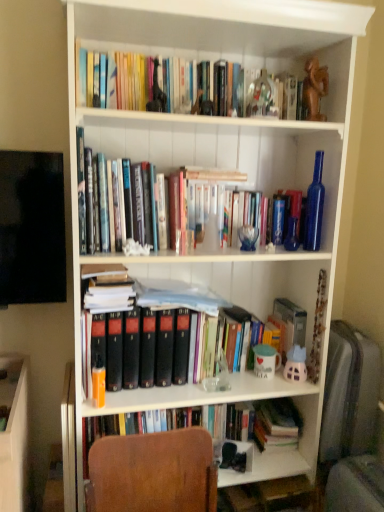
Question: From a real-world perspective, is brown wooden statue at upper center above or below hardcover books at upper center?

Choices:
 (A) above
 (B) below

Answer: (B)

Question: In the image, is brown wooden statue at upper center on the left side or the right side of hardcover books at upper center?

Choices:
 (A) left
 (B) right

Answer: (B)

Question: Which object is the farthest from the hardcover books at upper center?

Choices:
 (A) brown wooden statue at upper center
 (B) orange matte book at left

Answer: (B)

Question: Which object is positioned closest to the orange matte book at left?

Choices:
 (A) brown wooden statue at upper center
 (B) hardcover books at upper center

Answer: (B)